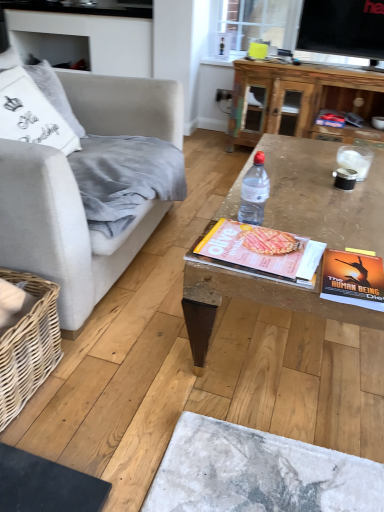
Question: In terms of width, does clear plastic bottle at center look wider or thinner when compared to wooden coffee table at center?

Choices:
 (A) thin
 (B) wide

Answer: (A)

Question: Is point (263, 203) positioned closer to the camera than point (276, 225)?

Choices:
 (A) closer
 (B) farther

Answer: (A)

Question: Estimate the real-world distances between objects in this image. Which object is closer to the clear plastic bottle at center?

Choices:
 (A) wooden coffee table at upper center
 (B) woven wood basket at lower left
 (C) hardcover book at center right
 (D) wooden coffee table at center
 (E) matte yellow magazine at center

Answer: (E)

Question: Which of these objects is positioned closest to the woven wood basket at lower left?

Choices:
 (A) clear plastic bottle at center
 (B) hardcover book at center right
 (C) wooden coffee table at upper center
 (D) light gray fabric couch at left
 (E) matte yellow magazine at center

Answer: (D)